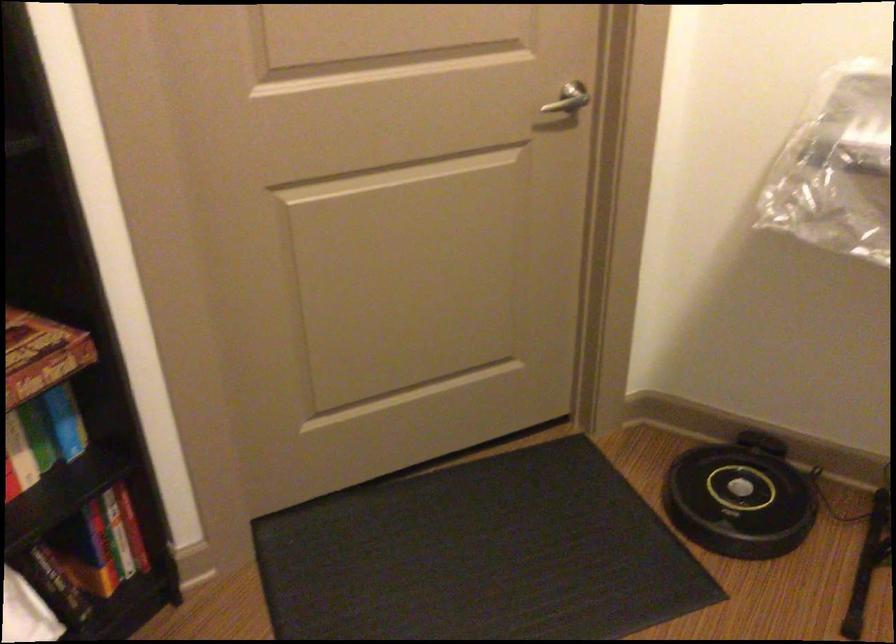
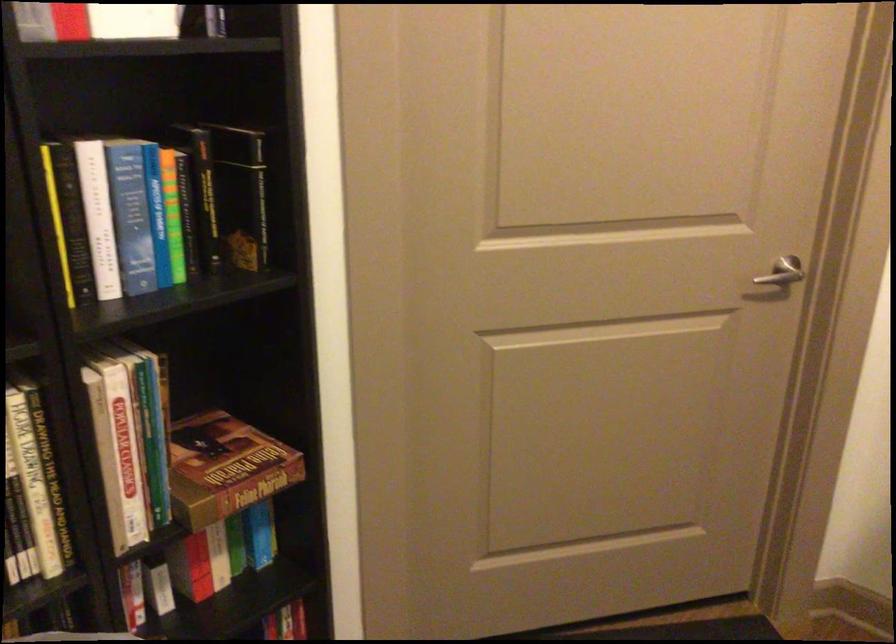
The point at (565, 102) is marked in the first image. Where is the corresponding point in the second image?

(781, 272)